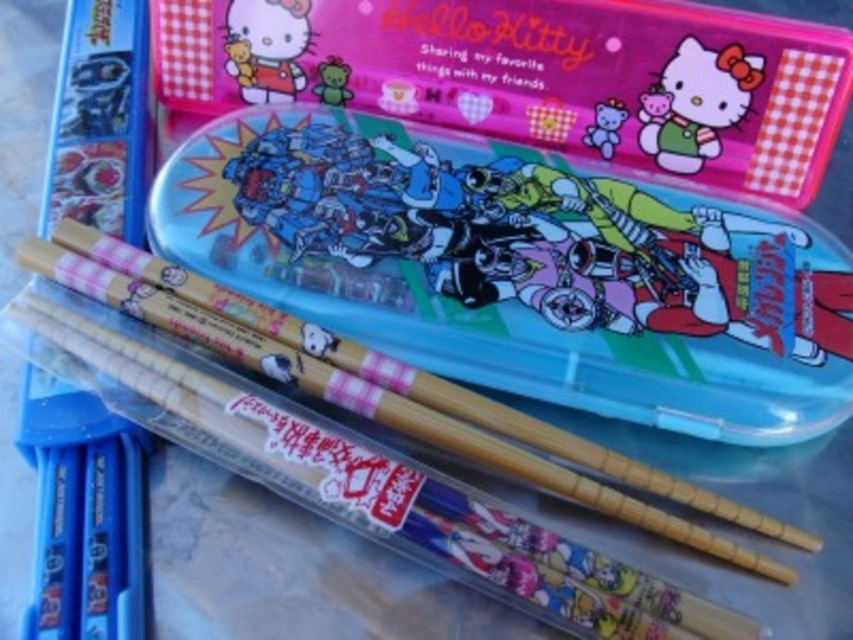
Is matte plastic chopsticks at lower left above matte pink bear at upper center?

Yes.

Which is behind, point (112, 93) or point (596, 122)?

Point (596, 122)

Locate an element on the screen. matte plastic chopsticks at lower left is located at coordinates (96, 97).

Which of these two, translucent plastic lunch box at upper center or matte pink bear at upper center, stands taller?

Standing taller between the two is translucent plastic lunch box at upper center.

Is translucent plastic lunch box at upper center to the left of matte pink bear at upper center from the viewer's perspective?

Indeed, translucent plastic lunch box at upper center is positioned on the left side of matte pink bear at upper center.

The image size is (853, 640). In order to click on translucent plastic lunch box at upper center in this screenshot , I will do `click(520, 268)`.

The height and width of the screenshot is (640, 853). In order to click on translucent plastic lunch box at upper center in this screenshot , I will do `click(520, 268)`.

Can you confirm if matte plastic chopsticks at lower left is positioned below matte pink plush bear at upper center?

Correct, matte plastic chopsticks at lower left is located below matte pink plush bear at upper center.

Is point (93, 61) closer to camera compared to point (322, 92)?

Yes, it is in front of point (322, 92).

Image resolution: width=853 pixels, height=640 pixels. I want to click on matte plastic chopsticks at lower left, so click(96, 97).